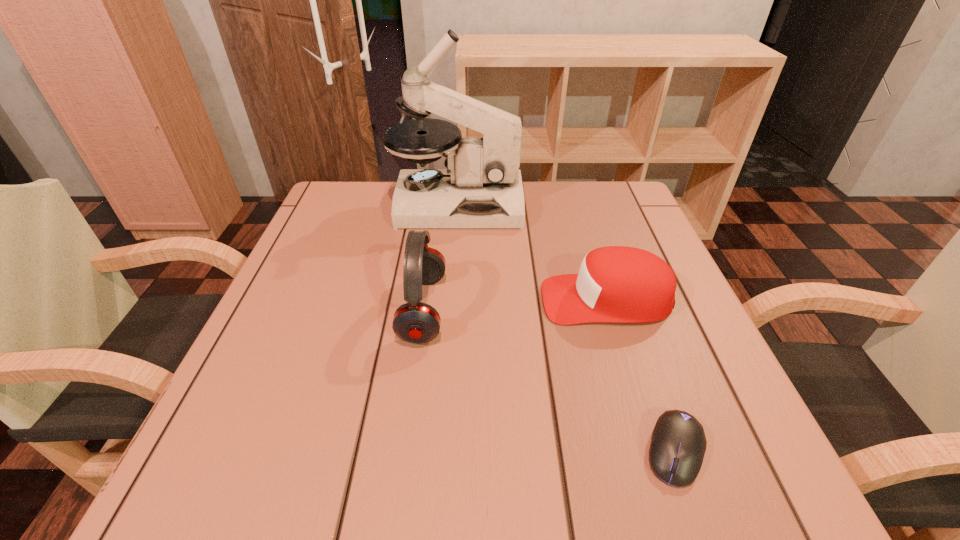
Locate which object is the second closest to the farthest object. Please provide its 2D coordinates. Your answer should be formatted as a tuple, i.e. [(x, y)], where the tuple contains the x and y coordinates of a point satisfying the conditions above.

[(616, 284)]

You are a GUI agent. You are given a task and a screenshot of the screen. Output one action in this format:
    pyautogui.click(x=<x>, y=<y>)
    Task: Click on the vacant space that satisfies the following two spatial constraints: 1. at the eyepiece of the nearest object; 2. on the right side of the microscope
    Image resolution: width=960 pixels, height=540 pixels.
    Given the screenshot: What is the action you would take?
    pyautogui.click(x=438, y=451)

This screenshot has height=540, width=960. I want to click on free space that satisfies the following two spatial constraints: 1. on the front-facing side of the baseball cap; 2. on the left side of the nearest object, so click(653, 451).

Identify the location of free space in the image that satisfies the following two spatial constraints: 1. on the back side of the computer mouse; 2. on the ear cups of the third shortest object. (626, 309).

This screenshot has width=960, height=540. I want to click on vacant point that satisfies the following two spatial constraints: 1. on the ear cups of the nearest object; 2. on the left side of the earphone, so click(x=404, y=451).

Image resolution: width=960 pixels, height=540 pixels. I want to click on free space that satisfies the following two spatial constraints: 1. on the front-facing side of the shortest object; 2. on the left side of the baseball cap, so click(x=653, y=451).